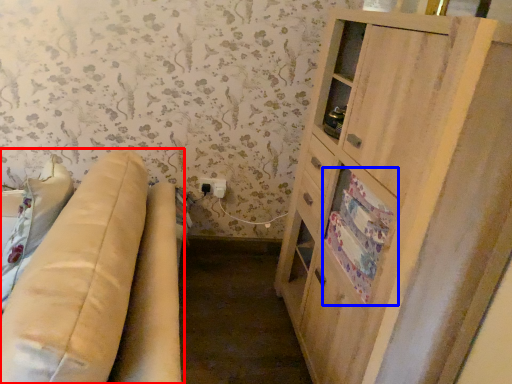
Question: Which of the following is the farthest to the observer, studio couch (highlighted by a red box) or drawer (highlighted by a blue box)?

Choices:
 (A) studio couch
 (B) drawer

Answer: (B)